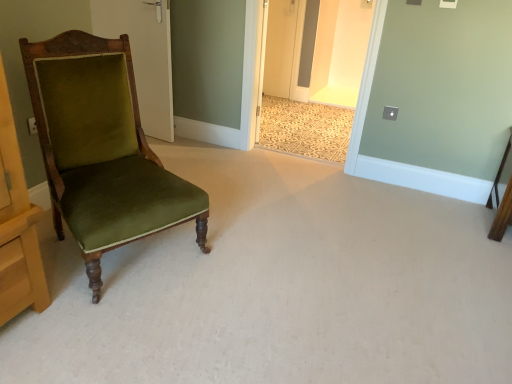
Question: From the image's perspective, is velvet green chair at left located above or below white wood door at upper left?

Choices:
 (A) below
 (B) above

Answer: (A)

Question: Visually, is velvet green chair at left positioned to the left or to the right of white wood door at upper left?

Choices:
 (A) left
 (B) right

Answer: (B)

Question: Does point (117, 235) appear closer or farther from the camera than point (157, 76)?

Choices:
 (A) closer
 (B) farther

Answer: (A)

Question: Is point (168, 11) closer or farther from the camera than point (134, 208)?

Choices:
 (A) farther
 (B) closer

Answer: (A)

Question: Looking at their shapes, would you say white wood door at upper left is wider or thinner than velvet green chair at left?

Choices:
 (A) wide
 (B) thin

Answer: (B)

Question: From the image's perspective, is white wood door at upper left located above or below velvet green chair at left?

Choices:
 (A) below
 (B) above

Answer: (B)

Question: Considering the positions of white wood door at upper left and velvet green chair at left in the image, is white wood door at upper left taller or shorter than velvet green chair at left?

Choices:
 (A) short
 (B) tall

Answer: (B)